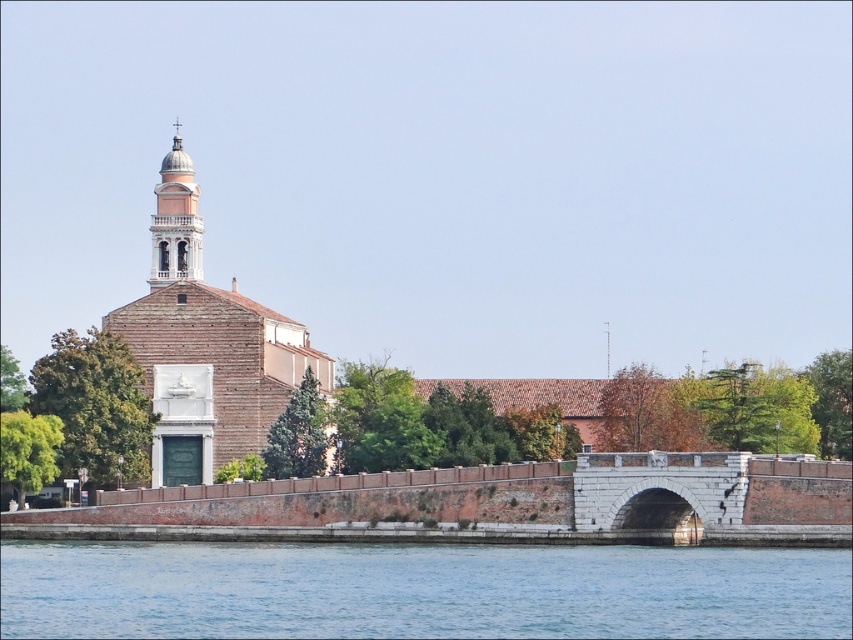
Does white stone bridge at center have a larger size compared to light pink stone bell tower at upper left?

No, white stone bridge at center is not bigger than light pink stone bell tower at upper left.

Which is in front, point (740, 496) or point (167, 179)?

Point (740, 496) is in front.

Image resolution: width=853 pixels, height=640 pixels. What do you see at coordinates (711, 492) in the screenshot?
I see `white stone bridge at center` at bounding box center [711, 492].

Identify the location of white stone bridge at center. The image size is (853, 640). (711, 492).

Is blue water at lower center to the right of white stone bridge at center from the viewer's perspective?

In fact, blue water at lower center is to the left of white stone bridge at center.

Is point (201, 550) closer to viewer compared to point (585, 483)?

No, (201, 550) is behind (585, 483).

The image size is (853, 640). Identify the location of blue water at lower center. (419, 589).

Which is in front, point (496, 548) or point (294, 356)?

Point (496, 548)

Who is positioned more to the left, blue water at lower center or light brown brick church at left?

Positioned to the left is light brown brick church at left.

Who is more forward, (144, 568) or (252, 326)?

Positioned in front is point (144, 568).

Locate an element on the screen. blue water at lower center is located at coordinates (419, 589).